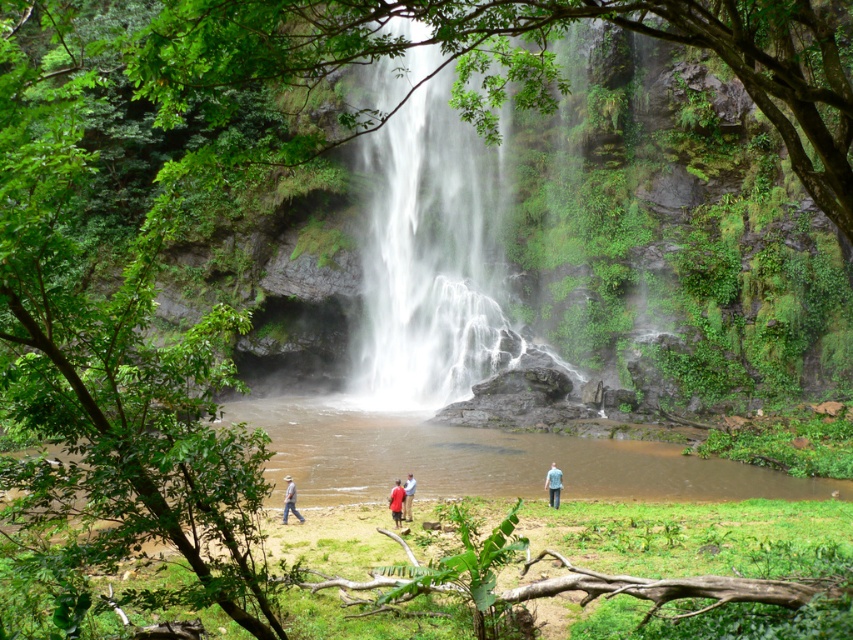
Who is more distant from viewer, (401, 77) or (556, 506)?

The point (401, 77) is more distant.

Where is `white silky waterfall at center`? Image resolution: width=853 pixels, height=640 pixels. white silky waterfall at center is located at coordinates (428, 259).

Based on the photo, between white silky waterfall at center and matte red shirt at center, which one has more height?

white silky waterfall at center

Measure the distance between white silky waterfall at center and matte red shirt at center.

A distance of 25.21 meters exists between white silky waterfall at center and matte red shirt at center.

Does point (409, 196) come behind point (393, 509)?

Yes, it is behind point (393, 509).

What are the coordinates of `white silky waterfall at center` in the screenshot? It's located at (428, 259).

Is blue denim jeans at lower center to the right of matte red shirt at center from the viewer's perspective?

Yes, blue denim jeans at lower center is to the right of matte red shirt at center.

Between point (556, 476) and point (395, 490), which one is positioned in front?

Positioned in front is point (395, 490).

Is point (556, 467) positioned after point (392, 490)?

Yes, point (556, 467) is farther from viewer.

Image resolution: width=853 pixels, height=640 pixels. In order to click on blue denim jeans at lower center in this screenshot , I will do [553, 484].